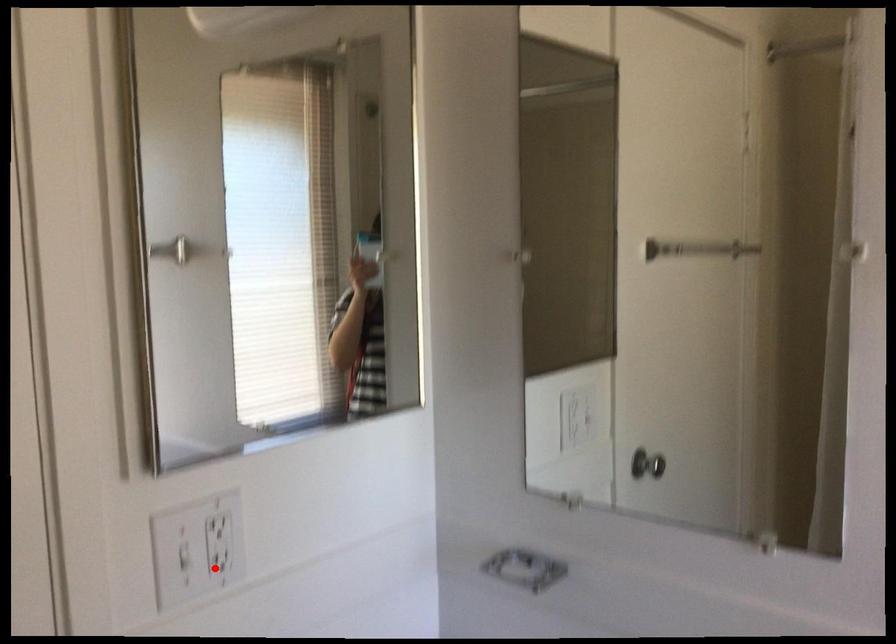
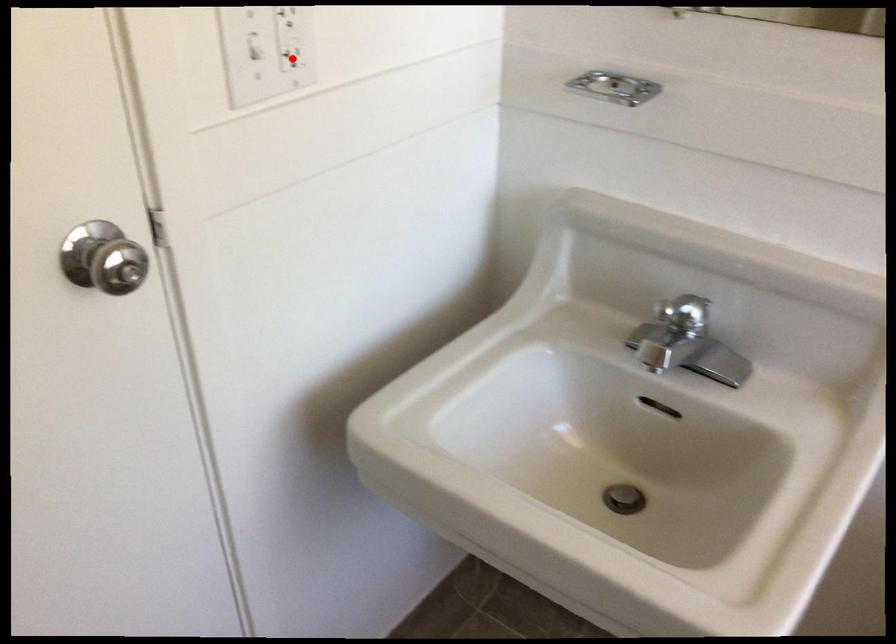
I am providing you with two images of the same scene from different viewpoints. A red point is marked on the first image and another point is marked on the second image. Is the red point in image1 aligned with the point shown in image2?

Yes